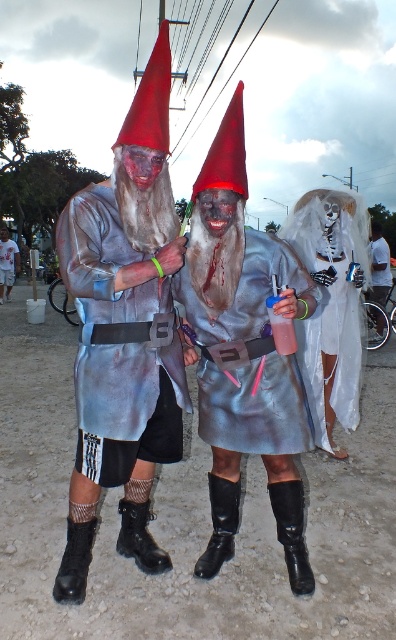
Does matte silver costume at center appear on the right side of white sheer fabric ghost at center?

Incorrect, matte silver costume at center is not on the right side of white sheer fabric ghost at center.

Can you confirm if matte silver costume at center is smaller than white sheer fabric ghost at center?

Correct, matte silver costume at center occupies less space than white sheer fabric ghost at center.

The image size is (396, 640). I want to click on matte silver costume at center, so click(x=245, y=352).

The image size is (396, 640). I want to click on matte silver costume at center, so click(x=245, y=352).

Which is behind, point (232, 291) or point (272, 442)?

The point (272, 442) is more distant.

Does matte silver costume at center appear on the right side of metallic silver dress at center?

Correct, you'll find matte silver costume at center to the right of metallic silver dress at center.

Identify the location of matte silver costume at center. The width and height of the screenshot is (396, 640). (245, 352).

From the picture: Between brushed silver robe at center and white sheer fabric ghost at center, which one is positioned higher?

Positioned higher is brushed silver robe at center.

Who is more forward, (140, 420) or (348, 205)?

Point (140, 420)

Does point (93, 321) come behind point (367, 228)?

No, (93, 321) is in front of (367, 228).

Find the location of `brushed silver robe at center`. brushed silver robe at center is located at coordinates (112, 317).